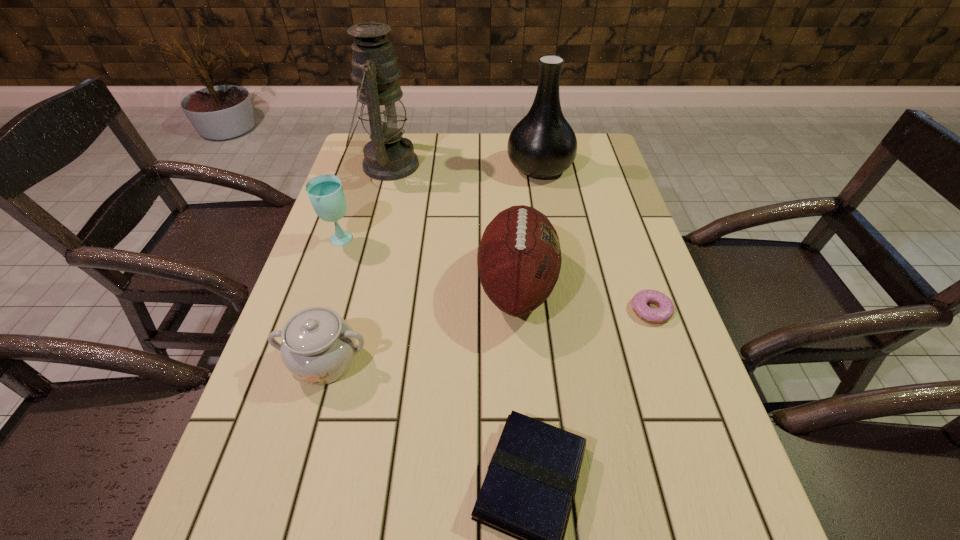
You are a GUI agent. You are given a task and a screenshot of the screen. Output one action in this format:
    pyautogui.click(x=<x>, y=<y>)
    Task: Click on the free space located on the front of the glass
    
    Given the screenshot: What is the action you would take?
    pyautogui.click(x=296, y=373)

I want to click on free location located 0.270m on the right of the third shortest object, so click(506, 362).

This screenshot has height=540, width=960. Identify the location of free space located on the left of the rightmost object. (590, 310).

Where is `oil lamp located in the far edge section of the desktop`? The width and height of the screenshot is (960, 540). oil lamp located in the far edge section of the desktop is located at coordinates (388, 156).

Image resolution: width=960 pixels, height=540 pixels. Identify the location of vase positioned at the far edge. (543, 144).

The width and height of the screenshot is (960, 540). Find the location of `oil lamp present at the left edge`. oil lamp present at the left edge is located at coordinates (388, 156).

Where is `glass that is at the left edge`? glass that is at the left edge is located at coordinates (x=325, y=192).

This screenshot has height=540, width=960. In order to click on chinaware that is at the left edge in this screenshot , I will do `click(318, 346)`.

Identify the location of vase present at the right edge. (543, 144).

At what (x,y) coordinates should I click in order to perform the action: click on doughnut present at the right edge. Please return your answer as a coordinate pair (x, y). Looking at the image, I should click on (665, 311).